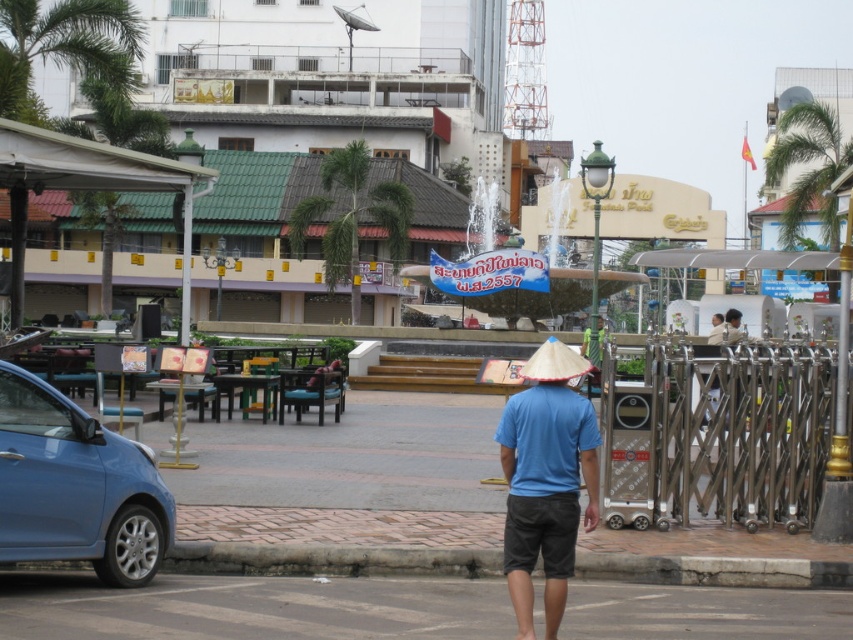
Can you confirm if blue metallic car at lower left is positioned below natural straw hat at center?

Correct, blue metallic car at lower left is located below natural straw hat at center.

Locate an element on the screen. Image resolution: width=853 pixels, height=640 pixels. blue metallic car at lower left is located at coordinates (76, 486).

Can you confirm if blue cotton shirt at center is positioned to the right of green leafy palm tree at upper left?

Correct, you'll find blue cotton shirt at center to the right of green leafy palm tree at upper left.

Does point (538, 515) come behind point (18, 74)?

No, it is not.

Is point (549, 605) closer to viewer compared to point (21, 90)?

That is True.

The width and height of the screenshot is (853, 640). I want to click on blue cotton shirt at center, so coord(546,481).

Does point (105, 522) lie in front of point (352, 198)?

That is True.

Can you confirm if blue metallic car at lower left is taller than green leafy palm tree at center?

No, blue metallic car at lower left is not taller than green leafy palm tree at center.

What do you see at coordinates (76, 486) in the screenshot? I see `blue metallic car at lower left` at bounding box center [76, 486].

Identify the location of blue metallic car at lower left. (76, 486).